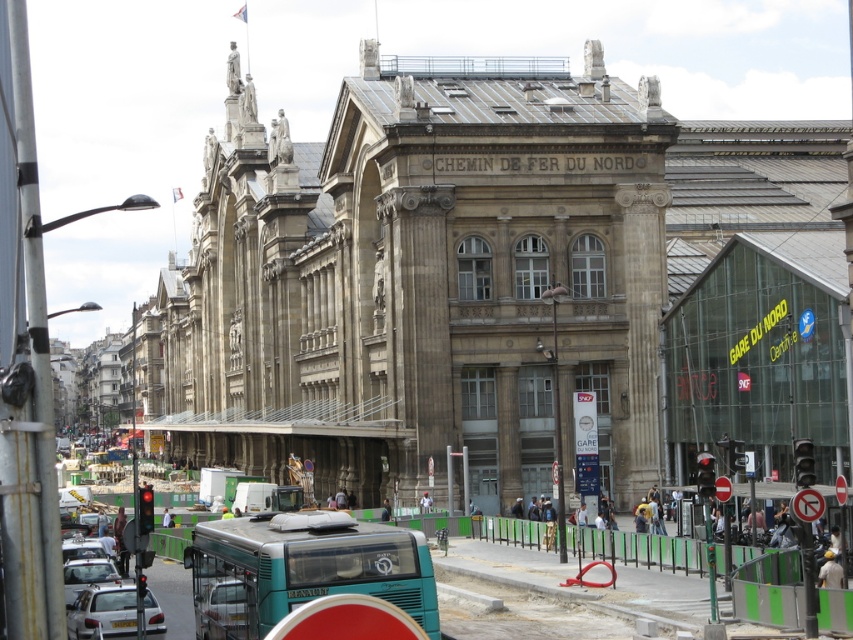
You are standing at the center of the image. Which direction should you move to reach the silver metallic sedan at lower left?

You should move to the lower left direction to reach the silver metallic sedan at lower left since its 2D location is at point (102, 612), which is in the lower left quadrant of the image.